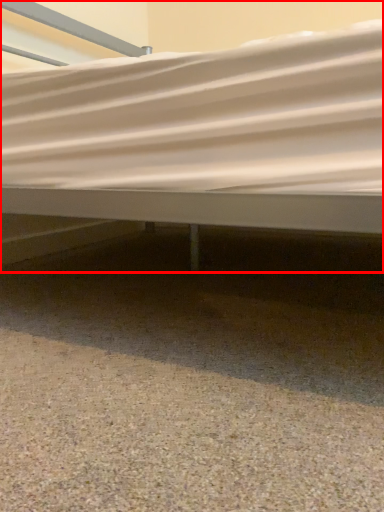
Question: From the image, what is the correct spatial relationship of bed (annotated by the red box) in relation to gravel?

Choices:
 (A) right
 (B) left

Answer: (A)